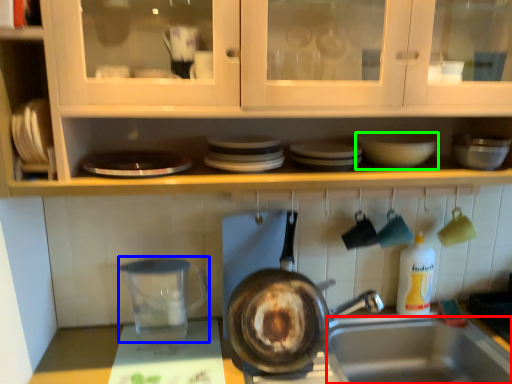
Question: Which is farther away from sink (highlighted by a red box)? appliance (highlighted by a blue box) or basin (highlighted by a green box)?

Choices:
 (A) appliance
 (B) basin

Answer: (B)